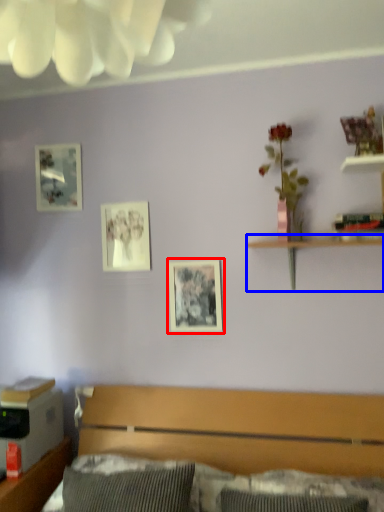
Question: Which object appears closest to the camera in this image, picture frame (highlighted by a red box) or shelf (highlighted by a blue box)?

Choices:
 (A) picture frame
 (B) shelf

Answer: (B)